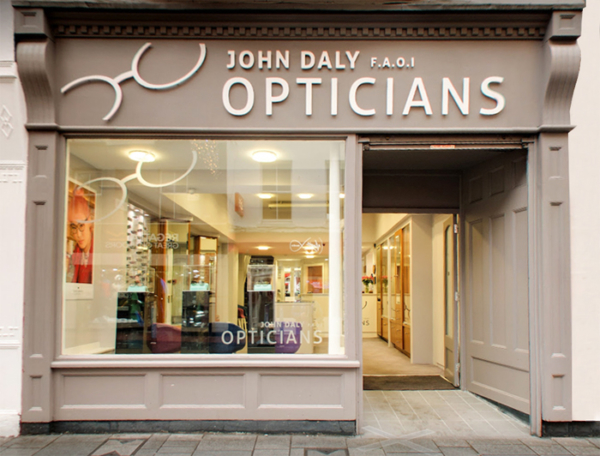
Locate an element on the screen. The width and height of the screenshot is (600, 456). left maroon chair is located at coordinates [x=161, y=337].